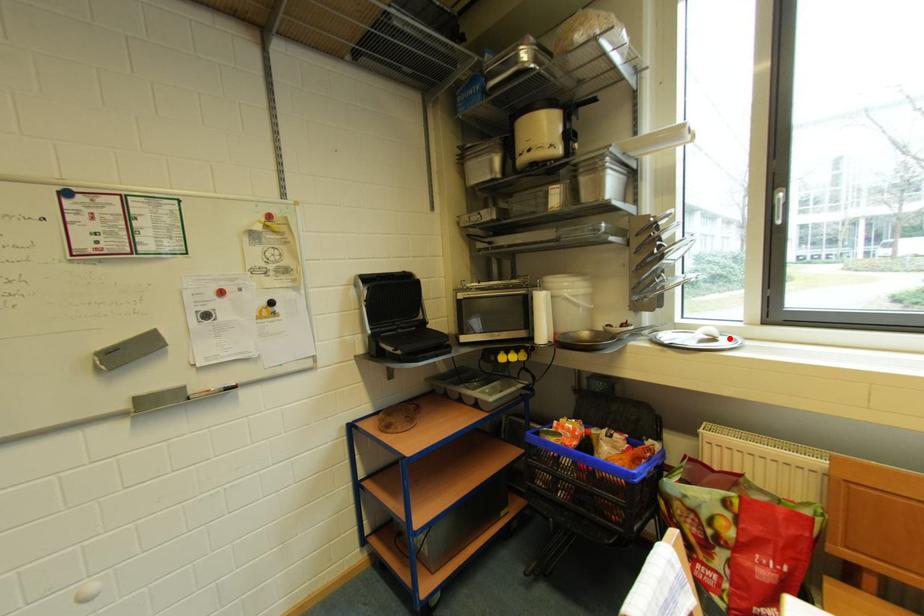
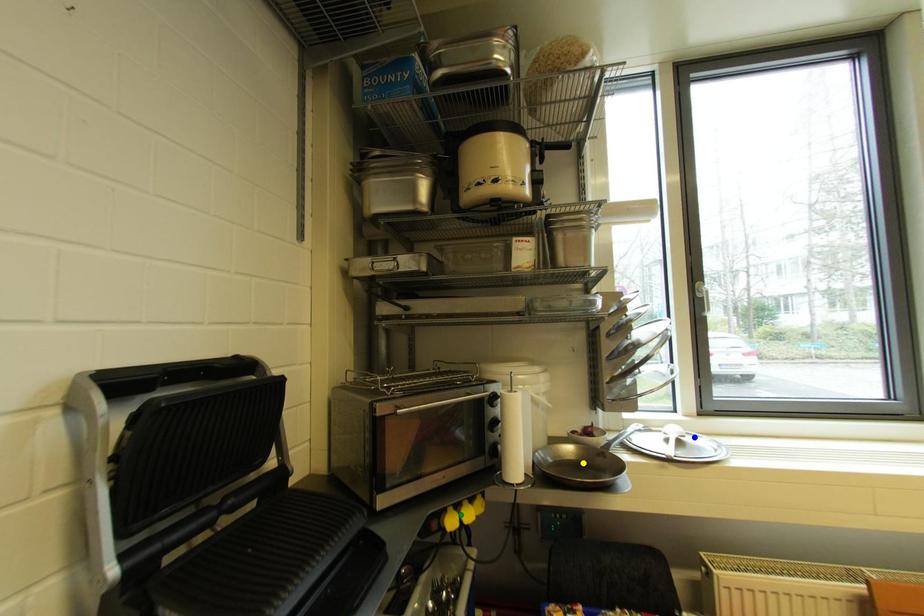
Question: I am providing you with two images of the same scene from different viewpoints. A red point is marked on the first image. You are given multiple points on the second image. In image 2, which mark is for the same physical point as the one in image 1?

Choices:
 (A) green point
 (B) yellow point
 (C) blue point

Answer: (C)